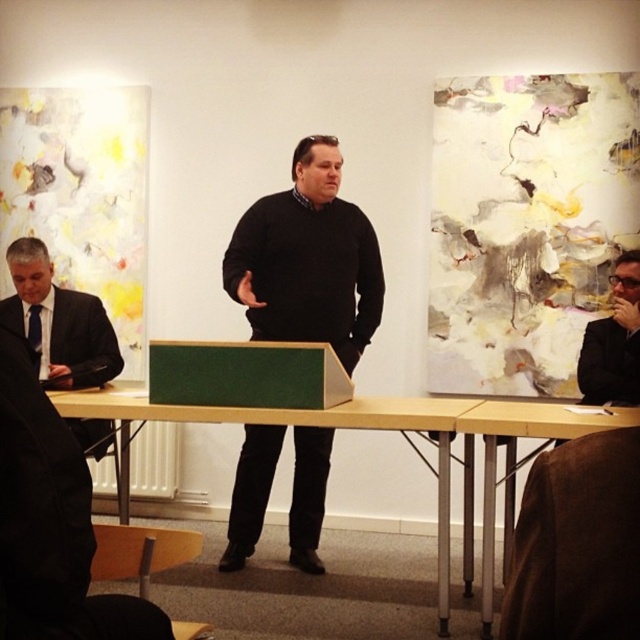
Question: Considering the real-world distances, which object is closest to the matte black suit at right?

Choices:
 (A) yellow wood table at lower right
 (B) matte black suit at left
 (C) black sweater at center
 (D) green wood table at center

Answer: (A)

Question: Is yellow wood table at lower right above matte black suit at right?

Choices:
 (A) yes
 (B) no

Answer: (B)

Question: Can you confirm if black sweater at center is positioned to the left of matte black suit at right?

Choices:
 (A) yes
 (B) no

Answer: (A)

Question: Can you confirm if matte black suit at left is bigger than matte black suit at right?

Choices:
 (A) no
 (B) yes

Answer: (B)

Question: Considering the real-world distances, which object is farthest from the matte black suit at right?

Choices:
 (A) yellow wood table at lower right
 (B) green wood table at center
 (C) black sweater at center

Answer: (C)

Question: Estimate the real-world distances between objects in this image. Which object is closer to the black sweater at center?

Choices:
 (A) matte black suit at left
 (B) matte black suit at right

Answer: (A)